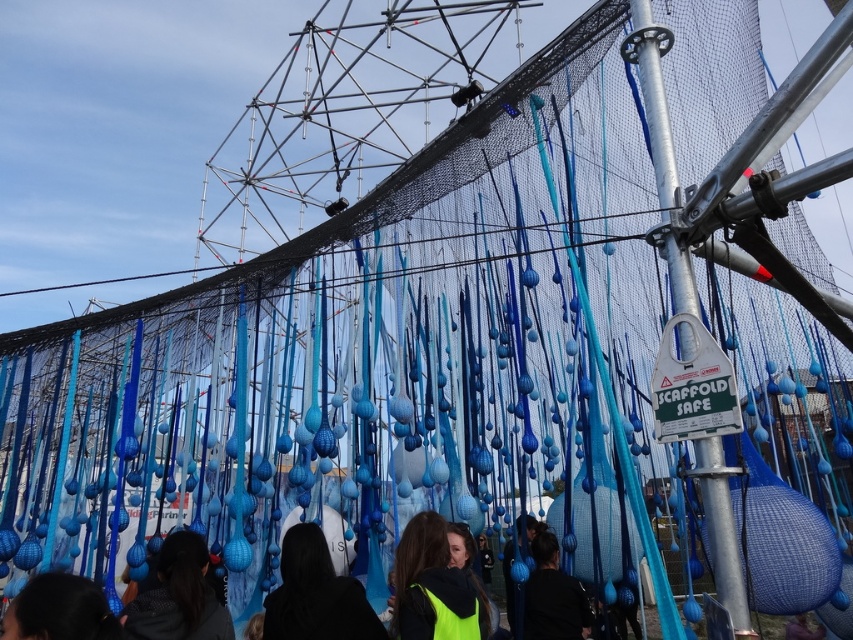
Question: Does dark brown hair at center appear on the right side of matte black hair at lower left?

Choices:
 (A) yes
 (B) no

Answer: (A)

Question: Does dark brown hair at center have a smaller size compared to dark brown hair at lower left?

Choices:
 (A) yes
 (B) no

Answer: (B)

Question: Which is nearer to the black matte jacket at center?

Choices:
 (A) silver metallic pole at center
 (B) dark brown hair at lower left

Answer: (A)

Question: Which object is the farthest from the silver metallic pole at center?

Choices:
 (A) neon yellow fabric at lower center
 (B) dark brown hair at lower left

Answer: (A)

Question: Estimate the real-world distances between objects in this image. Which object is closer to the black matte jacket at center?

Choices:
 (A) dark brown hair at lower left
 (B) neon yellow fabric at lower center
 (C) neon yellow jacket at center
 (D) matte black hair at lower left

Answer: (C)

Question: Is matte black hair at lower left below dark brown hair at lower left?

Choices:
 (A) yes
 (B) no

Answer: (A)